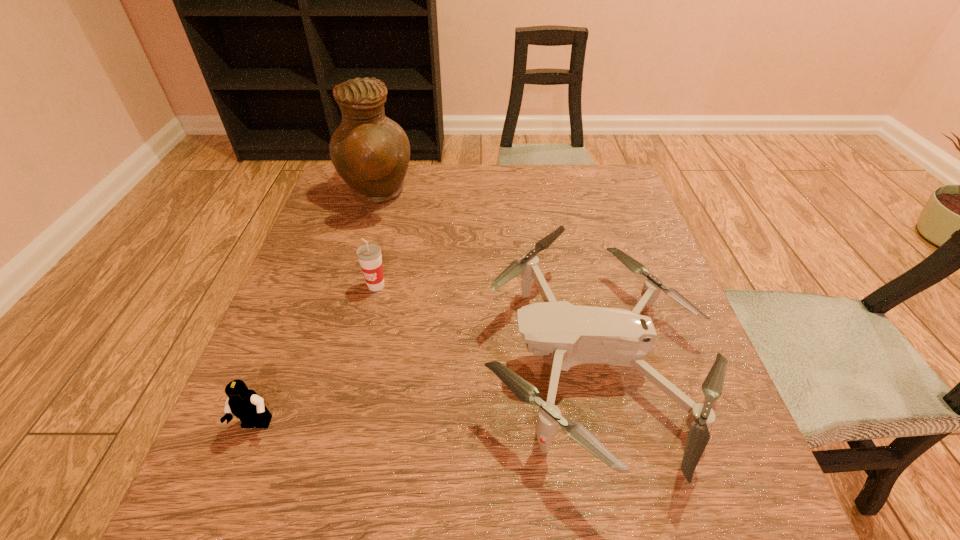
Find the location of `vacant space situated on the front-facing side of the Lego`. vacant space situated on the front-facing side of the Lego is located at coordinates (228, 496).

You are a GUI agent. You are given a task and a screenshot of the screen. Output one action in this format:
    pyautogui.click(x=<x>, y=<y>)
    Task: Click on the object that is at the far edge
    The height and width of the screenshot is (540, 960).
    Given the screenshot: What is the action you would take?
    pyautogui.click(x=371, y=153)

Image resolution: width=960 pixels, height=540 pixels. What are the coordinates of `object located at the near edge` in the screenshot? It's located at (575, 335).

Identify the location of pitcher positioned at the left edge. (371, 153).

Where is `cup situated at the left edge`? The height and width of the screenshot is (540, 960). cup situated at the left edge is located at coordinates (369, 255).

Find the location of a particular element. The image size is (960, 540). Lego positioned at the left edge is located at coordinates (247, 405).

Locate an element on the screen. The width and height of the screenshot is (960, 540). object at the right edge is located at coordinates (575, 335).

Find the location of a particular element. object at the far left corner is located at coordinates (371, 153).

Where is `object present at the near right corner`? The width and height of the screenshot is (960, 540). object present at the near right corner is located at coordinates [x=575, y=335].

This screenshot has width=960, height=540. Identify the location of blank space at the far edge. (497, 186).